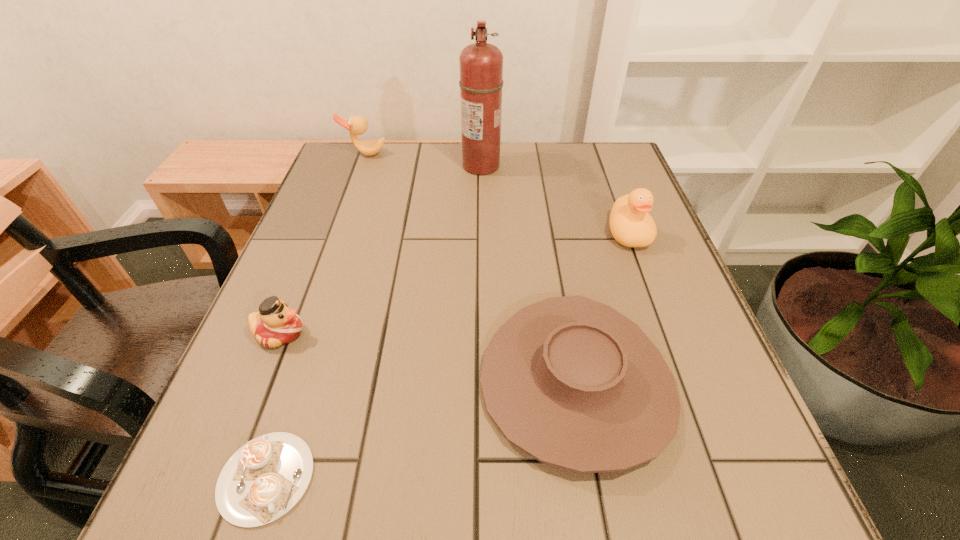
Where is `duck present at the right edge`? Image resolution: width=960 pixels, height=540 pixels. duck present at the right edge is located at coordinates (631, 225).

Image resolution: width=960 pixels, height=540 pixels. Find the location of `cowboy hat positioned at the right edge`. cowboy hat positioned at the right edge is located at coordinates (572, 382).

The image size is (960, 540). What are the coordinates of `object at the far left corner` in the screenshot? It's located at (357, 125).

Locate an element on the screen. This screenshot has width=960, height=540. object located at the near left corner is located at coordinates (266, 477).

Image resolution: width=960 pixels, height=540 pixels. I want to click on object at the near right corner, so [572, 382].

The width and height of the screenshot is (960, 540). I want to click on vacant area at the far edge of the desktop, so coord(525,147).

In the image, there is a desktop. In order to click on free region at the near edge in this screenshot , I will do `click(604, 529)`.

Locate an element on the screen. This screenshot has width=960, height=540. free space at the right edge of the desktop is located at coordinates (680, 434).

The width and height of the screenshot is (960, 540). What are the coordinates of `vacant space at the far left corner of the desktop` in the screenshot? It's located at (353, 184).

Image resolution: width=960 pixels, height=540 pixels. In the image, there is a desktop. In order to click on free space at the far right corner in this screenshot , I will do `click(575, 180)`.